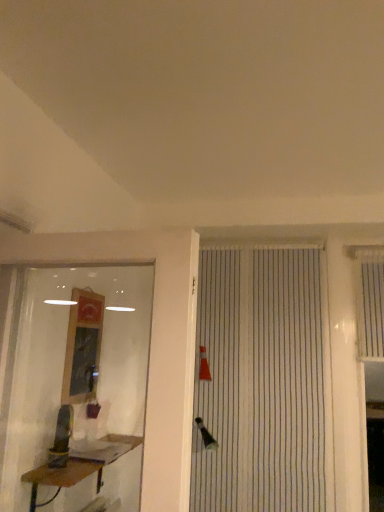
What is the approximate height of transparent glass shop window at left?

It is 33.95 inches.

The image size is (384, 512). Describe the element at coordinates (74, 382) in the screenshot. I see `transparent glass shop window at left` at that location.

The width and height of the screenshot is (384, 512). What do you see at coordinates (83, 347) in the screenshot?
I see `wooden framed mirror at left` at bounding box center [83, 347].

Identify the location of white striped shutter at right. The width and height of the screenshot is (384, 512). (369, 298).

Identify the location of transparent glass shop window at left. (74, 382).

Can you confirm if brown wooden table at lower left is taller than transparent glass shop window at left?

No, brown wooden table at lower left is not taller than transparent glass shop window at left.

From a real-world perspective, is brown wooden table at lower left beneath transparent glass shop window at left?

Indeed, from a real-world perspective, brown wooden table at lower left is positioned beneath transparent glass shop window at left.

Are brown wooden table at lower left and transparent glass shop window at left far apart?

No, brown wooden table at lower left is not far from transparent glass shop window at left.

Does brown wooden table at lower left have a greater width compared to transparent glass shop window at left?

Indeed, brown wooden table at lower left has a greater width compared to transparent glass shop window at left.

In the image, there is a wooden framed mirror at left. What are the coordinates of `shutter above it (from the image's perspective)` in the screenshot? It's located at (369, 298).

Are wooden framed mirror at left and white striped shutter at right far apart?

Yes, wooden framed mirror at left and white striped shutter at right are quite far apart.

Is wooden framed mirror at left wider than white striped shutter at right?

Incorrect, the width of wooden framed mirror at left does not surpass that of white striped shutter at right.

Measure the distance between wooden framed mirror at left and white striped shutter at right.

5.60 feet.

Are wooden framed mirror at left and white striped window blind at center making contact?

wooden framed mirror at left and white striped window blind at center are not in contact.

From a real-world perspective, is wooden framed mirror at left positioned under white striped window blind at center based on gravity?

No, from a real-world perspective, wooden framed mirror at left is not under white striped window blind at center.

Is point (84, 360) closer to viewer compared to point (202, 382)?

That is True.

Is wooden framed mirror at left inside the boundaries of white striped window blind at center, or outside?

wooden framed mirror at left is not enclosed by white striped window blind at center.

Looking at their sizes, would you say white striped window blind at center is wider or thinner than transparent glass shop window at left?

Clearly, white striped window blind at center has less width compared to transparent glass shop window at left.

Considering the positions of point (201, 389) and point (48, 413), is point (201, 389) closer or farther from the camera than point (48, 413)?

Clearly, point (201, 389) is more distant from the camera than point (48, 413).

Is white striped window blind at center taller than transparent glass shop window at left?

Yes.

Is white striped window blind at center facing towards transparent glass shop window at left?

Yes, white striped window blind at center is aimed at transparent glass shop window at left.

Based on the photo, considering the relative positions of white striped shutter at right and transparent glass shop window at left in the image provided, is white striped shutter at right to the right of transparent glass shop window at left from the viewer's perspective?

Correct, you'll find white striped shutter at right to the right of transparent glass shop window at left.

Who is taller, white striped shutter at right or transparent glass shop window at left?

transparent glass shop window at left is taller.

Find the location of a particular element. This screenshot has width=384, height=512. shutter that is on the right side of transparent glass shop window at left is located at coordinates (369, 298).

Considering the relative sizes of white striped shutter at right and transparent glass shop window at left in the image provided, is white striped shutter at right bigger than transparent glass shop window at left?

Incorrect, white striped shutter at right is not larger than transparent glass shop window at left.

Considering the positions of point (370, 300) and point (78, 302), is point (370, 300) closer or farther from the camera than point (78, 302)?

Point (370, 300) is positioned farther from the camera compared to point (78, 302).

How different are the orientations of white striped shutter at right and wooden framed mirror at left in degrees?

The angular difference between white striped shutter at right and wooden framed mirror at left is 89.1 degrees.

From a real-world perspective, which is physically below, white striped shutter at right or wooden framed mirror at left?

wooden framed mirror at left, from a real-world perspective.

Considering the sizes of objects white striped shutter at right and wooden framed mirror at left in the image provided, who is taller, white striped shutter at right or wooden framed mirror at left?

white striped shutter at right.

Based on their sizes in the image, would you say transparent glass shop window at left is bigger or smaller than white striped shutter at right?

Considering their sizes, transparent glass shop window at left takes up more space than white striped shutter at right.

How distant is transparent glass shop window at left from white striped shutter at right?

5.27 feet.

Where is `shop window that is below the white striped shutter at right (from the image's perspective)`? The height and width of the screenshot is (512, 384). shop window that is below the white striped shutter at right (from the image's perspective) is located at coordinates (74, 382).

Does point (73, 285) come behind point (366, 249)?

No, it is not.

Where is `shop window located on the right of brown wooden table at lower left`? This screenshot has height=512, width=384. shop window located on the right of brown wooden table at lower left is located at coordinates (74, 382).

In the image, there is a wooden framed mirror at left. Where is `shutter above it (from the image's perspective)`? The image size is (384, 512). shutter above it (from the image's perspective) is located at coordinates (369, 298).

Looking at the image, which one is located further to transparent glass shop window at left, white striped shutter at right or wooden framed mirror at left?

The object further to transparent glass shop window at left is white striped shutter at right.

When comparing their distances from brown wooden table at lower left, does wooden framed mirror at left or white striped shutter at right seem further?

The object further to brown wooden table at lower left is white striped shutter at right.

Based on their spatial positions, is transparent glass shop window at left or white striped shutter at right further from brown wooden table at lower left?

Based on the image, white striped shutter at right appears to be further to brown wooden table at lower left.

Based on their spatial positions, is white striped shutter at right or brown wooden table at lower left further from transparent glass shop window at left?

white striped shutter at right.

Based on their spatial positions, is transparent glass shop window at left or wooden framed mirror at left further from white striped window blind at center?

Based on the image, wooden framed mirror at left appears to be further to white striped window blind at center.

Considering their positions, is transparent glass shop window at left positioned closer to wooden framed mirror at left than brown wooden table at lower left?

The object closer to wooden framed mirror at left is transparent glass shop window at left.

Considering their positions, is wooden framed mirror at left positioned further to brown wooden table at lower left than white striped window blind at center?

white striped window blind at center is positioned further to the anchor brown wooden table at lower left.

In the scene shown: Which object lies further to the anchor point white striped shutter at right, transparent glass shop window at left or wooden framed mirror at left?

The object further to white striped shutter at right is wooden framed mirror at left.

Identify the location of job between transparent glass shop window at left and white striped window blind at center in the front-back direction. The width and height of the screenshot is (384, 512). (83, 347).

Find the location of a particular element. The width and height of the screenshot is (384, 512). window blind situated between wooden framed mirror at left and white striped shutter at right from left to right is located at coordinates (263, 382).

This screenshot has width=384, height=512. Find the location of `window blind situated between brown wooden table at lower left and white striped shutter at right from left to right`. window blind situated between brown wooden table at lower left and white striped shutter at right from left to right is located at coordinates (263, 382).

This screenshot has height=512, width=384. In order to click on window blind positioned between transparent glass shop window at left and white striped shutter at right from near to far in this screenshot , I will do `click(263, 382)`.